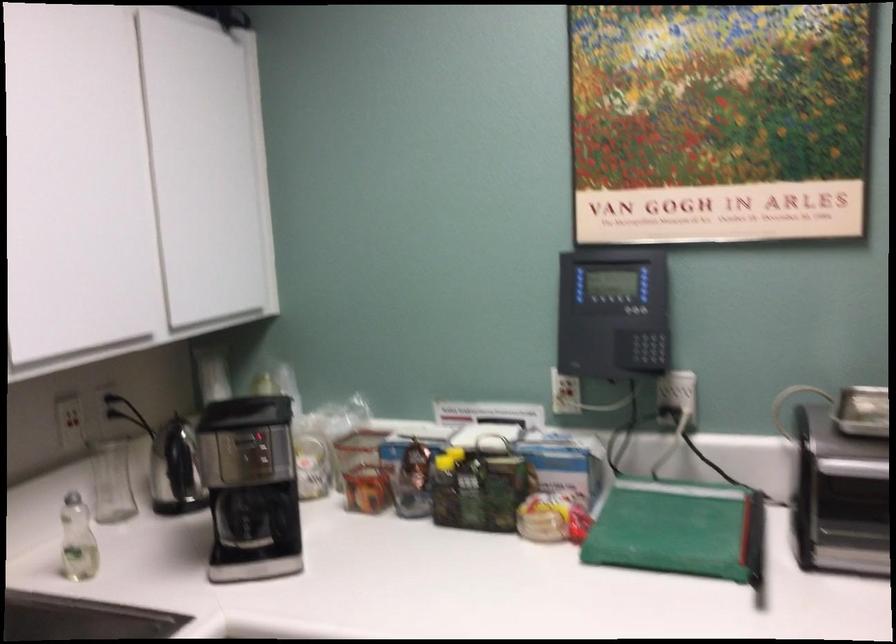
I want to click on keypad buttons, so click(x=642, y=348).